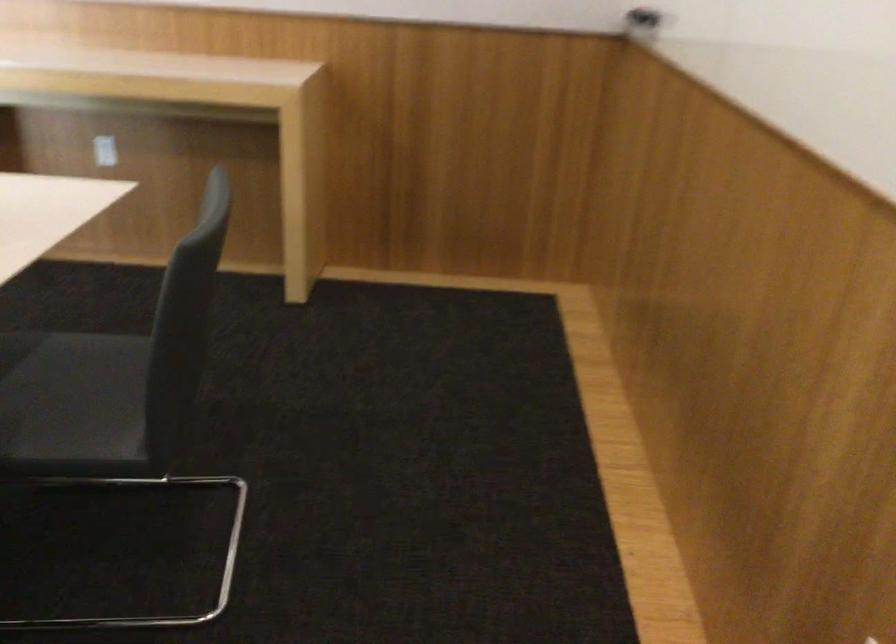
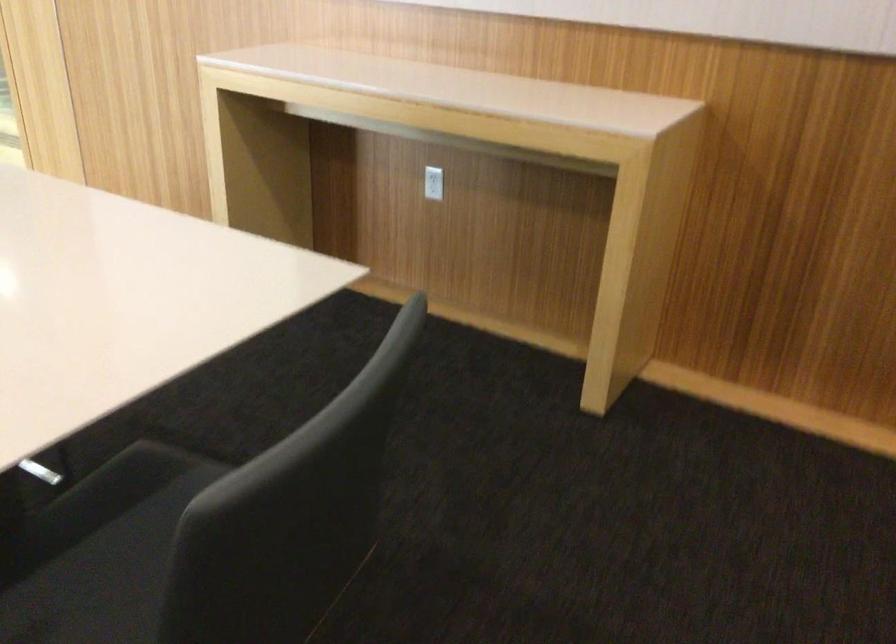
Where in the second image is the point corresponding to point 101,142 from the first image?

(433, 183)